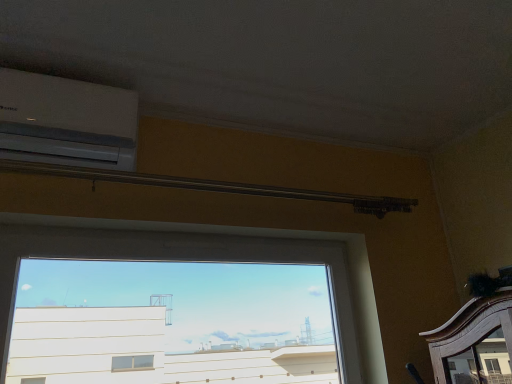
Question: In the image, is white plastic air conditioner at upper left on the left side or the right side of transparent glass window at center?

Choices:
 (A) left
 (B) right

Answer: (A)

Question: Is white plastic air conditioner at upper left spatially inside transparent glass window at center, or outside of it?

Choices:
 (A) inside
 (B) outside

Answer: (B)

Question: From their relative heights in the image, would you say white plastic air conditioner at upper left is taller or shorter than transparent glass window at center?

Choices:
 (A) tall
 (B) short

Answer: (B)

Question: From a real-world perspective, is transparent glass window at center positioned above or below white plastic air conditioner at upper left?

Choices:
 (A) above
 (B) below

Answer: (B)

Question: From the image's perspective, is transparent glass window at center above or below white plastic air conditioner at upper left?

Choices:
 (A) below
 (B) above

Answer: (A)

Question: Considering the relative positions of transparent glass window at center and white plastic air conditioner at upper left in the image provided, is transparent glass window at center to the left or to the right of white plastic air conditioner at upper left?

Choices:
 (A) left
 (B) right

Answer: (B)

Question: Is transparent glass window at center in front of or behind white plastic air conditioner at upper left in the image?

Choices:
 (A) behind
 (B) front

Answer: (B)